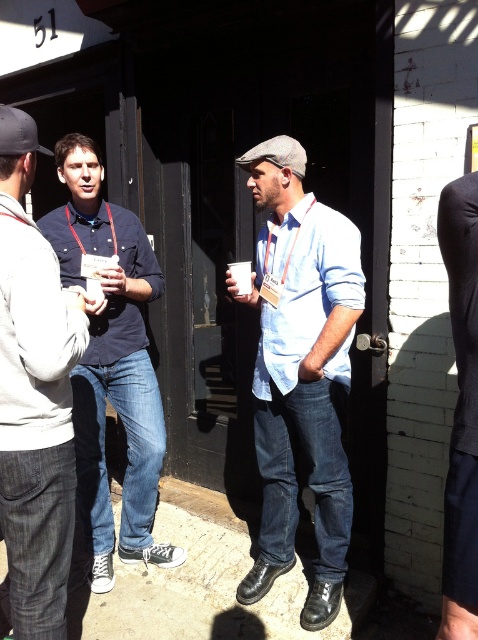
Question: Which point is farther from the camera taking this photo?

Choices:
 (A) (323, 417)
 (B) (159, 474)
 (C) (463, 321)

Answer: (B)

Question: Does light blue denim jeans at center come in front of white paper cup at center?

Choices:
 (A) no
 (B) yes

Answer: (B)

Question: Which of the following is the closest to the observer?

Choices:
 (A) (239, 269)
 (B) (35, 637)
 (C) (466, 458)

Answer: (C)

Question: Does light blue denim jeans at center have a smaller size compared to black smooth pants at right?

Choices:
 (A) yes
 (B) no

Answer: (B)

Question: Which of these objects is positioned closest to the dark blue shirt at center?

Choices:
 (A) matte black shirt at left
 (B) black smooth pants at right

Answer: (A)

Question: Is the position of matte black shirt at left less distant than that of black smooth pants at right?

Choices:
 (A) yes
 (B) no

Answer: (B)